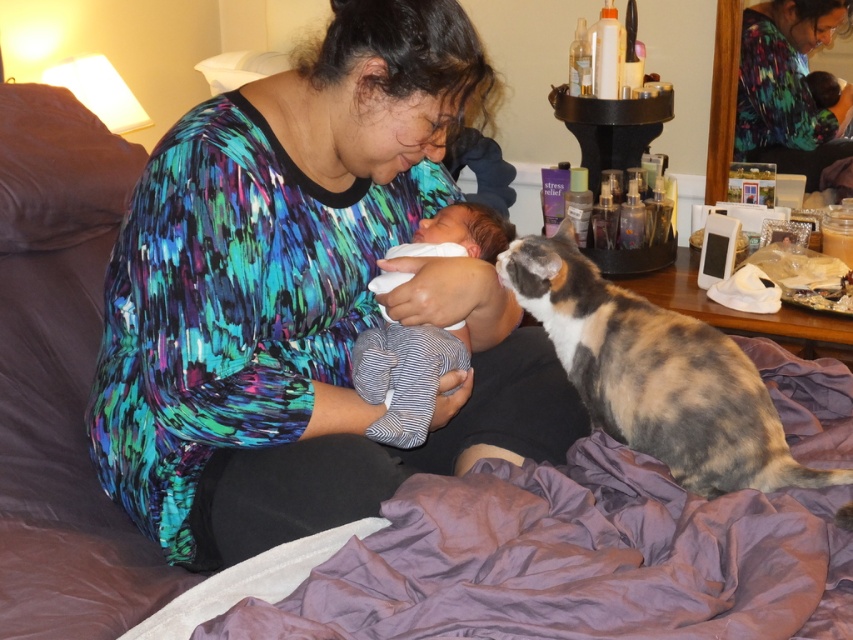
Question: Can you confirm if purple satin blanket at lower center is positioned above white soft baby at center?

Choices:
 (A) yes
 (B) no

Answer: (B)

Question: Does purple satin blanket at lower center have a larger size compared to multicolored printed shirt at upper center?

Choices:
 (A) yes
 (B) no

Answer: (A)

Question: Considering the real-world distances, which object is farthest from the multicolored fabric shirt at center?

Choices:
 (A) white soft baby at center
 (B) multicolored printed shirt at upper center

Answer: (B)

Question: Which point appears closest to the camera in this image?

Choices:
 (A) (534, 540)
 (B) (312, 218)

Answer: (A)

Question: Which point is farther from the camera taking this photo?

Choices:
 (A) (729, 448)
 (B) (437, 556)
 (C) (392, 445)
 (D) (753, 67)

Answer: (D)

Question: Is calico fur cat at right below multicolored printed shirt at upper center?

Choices:
 (A) yes
 (B) no

Answer: (A)